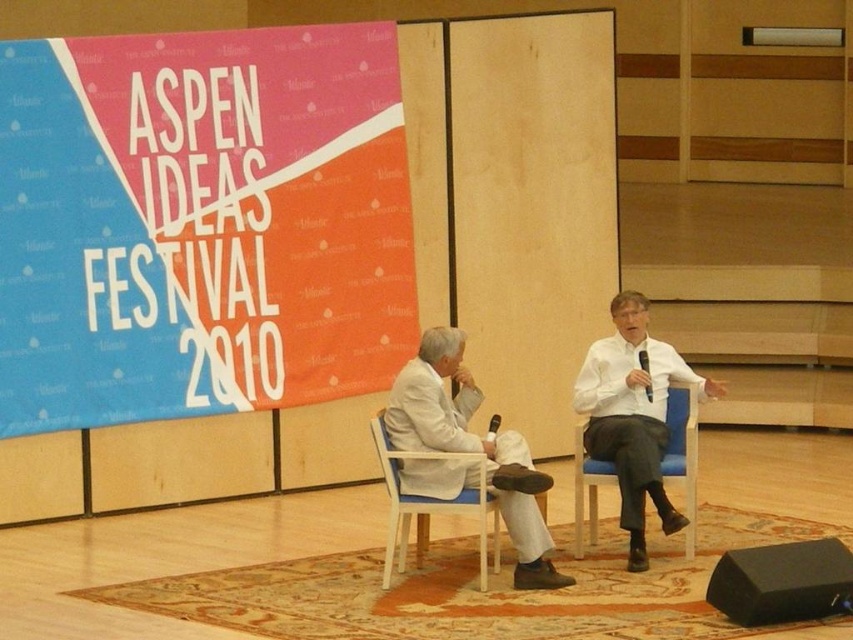
Who is shorter, white fabric suit at center or blue fabric chair at right?

Standing shorter between the two is blue fabric chair at right.

Between white fabric suit at center and blue fabric chair at right, which one appears on the right side from the viewer's perspective?

Positioned to the right is blue fabric chair at right.

Between point (506, 481) and point (589, 483), which one is positioned behind?

Positioned behind is point (589, 483).

The width and height of the screenshot is (853, 640). In order to click on white fabric suit at center in this screenshot , I will do `click(473, 448)`.

Looking at this image, between white plastic chair at center and blue fabric chair at right, which one is positioned lower?

white plastic chair at center is lower down.

Is white plastic chair at center to the right of blue fabric chair at right from the viewer's perspective?

In fact, white plastic chair at center is to the left of blue fabric chair at right.

Is point (416, 515) farther from camera compared to point (660, 470)?

Yes, point (416, 515) is behind point (660, 470).

At what (x,y) coordinates should I click in order to perform the action: click on white plastic chair at center. Please return your answer as a coordinate pair (x, y). Looking at the image, I should click on (431, 508).

Does black matte speaker at lower right appear under blue fabric chair at right?

Correct, black matte speaker at lower right is located below blue fabric chair at right.

How distant is black matte speaker at lower right from blue fabric chair at right?

1.58 meters

Where is `black matte speaker at lower right`? black matte speaker at lower right is located at coordinates coord(782,582).

Image resolution: width=853 pixels, height=640 pixels. What are the coordinates of `black matte speaker at lower right` in the screenshot? It's located at (782, 582).